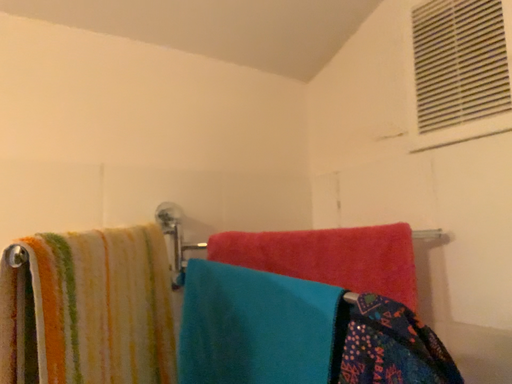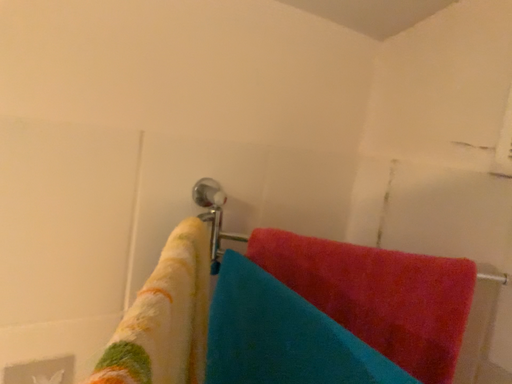
Question: Which way did the camera rotate in the video?

Choices:
 (A) rotated upward
 (B) rotated downward

Answer: (B)